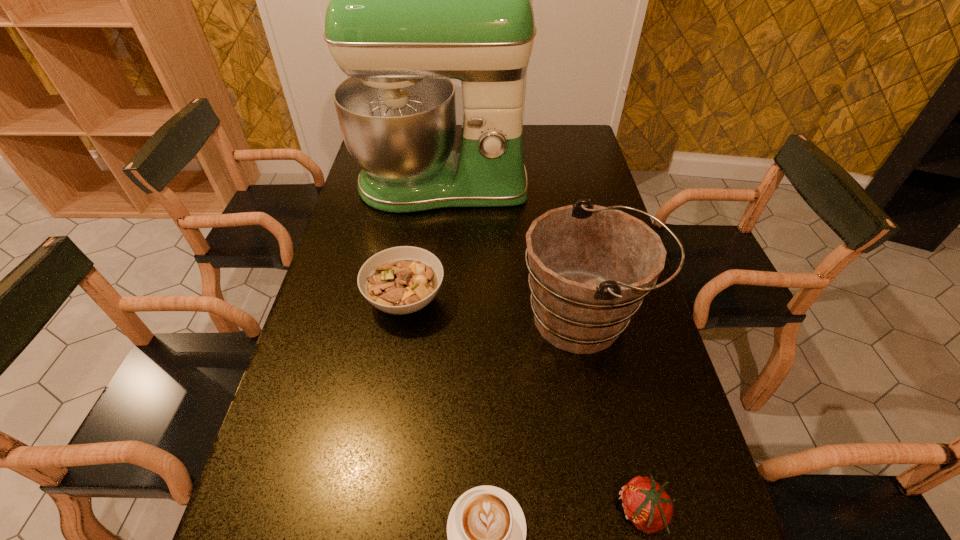
Find the location of a particular element. The image size is (960, 540). the tallest object is located at coordinates (416, 0).

Locate an element on the screen. mixer is located at coordinates (416, 0).

Locate an element on the screen. bucket is located at coordinates (590, 267).

The height and width of the screenshot is (540, 960). Identify the location of the third tallest object. (400, 280).

This screenshot has height=540, width=960. What are the coordinates of `free spot located 0.210m on the controls of the tallest object` in the screenshot? It's located at (434, 264).

Image resolution: width=960 pixels, height=540 pixels. I want to click on vacant space located 0.100m on the left of the stew, so click(x=327, y=299).

This screenshot has height=540, width=960. I want to click on mixer present at the left edge, so click(x=416, y=0).

I want to click on stew at the left edge, so click(400, 280).

I want to click on object present at the right edge, so click(x=590, y=267).

Find the location of a particular element. This screenshot has width=960, height=540. free region at the left edge is located at coordinates (338, 441).